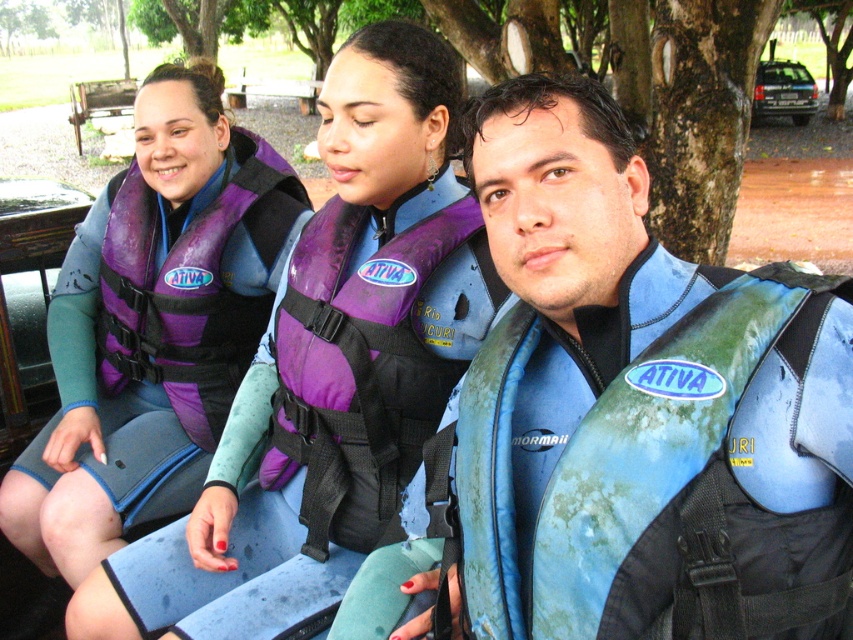
Is purple matte life vest at center bigger than purple matte life jacket at left?

Correct, purple matte life vest at center is larger in size than purple matte life jacket at left.

This screenshot has width=853, height=640. What do you see at coordinates (152, 324) in the screenshot?
I see `purple matte life vest at center` at bounding box center [152, 324].

Is point (271, 301) more distant than point (236, 208)?

Yes, point (271, 301) is behind point (236, 208).

The width and height of the screenshot is (853, 640). I want to click on purple matte life vest at center, so click(x=152, y=324).

Can you confirm if blue-green textured life vest at center-right is wider than purple matte life jacket at left?

No, blue-green textured life vest at center-right is not wider than purple matte life jacket at left.

Is blue-green textured life vest at center-right closer to the viewer compared to purple matte life jacket at left?

That is True.

Which is in front, point (489, 204) or point (252, 310)?

Positioned in front is point (489, 204).

Identify the location of blue-green textured life vest at center-right. (618, 381).

Who is higher up, purple matte life jacket at center or purple matte life jacket at left?

purple matte life jacket at left is above.

Does purple matte life jacket at center appear on the left side of purple matte life jacket at left?

No, purple matte life jacket at center is not to the left of purple matte life jacket at left.

Is point (384, 246) positioned before point (210, 420)?

That is True.

What are the coordinates of `purple matte life jacket at center` in the screenshot? It's located at (364, 364).